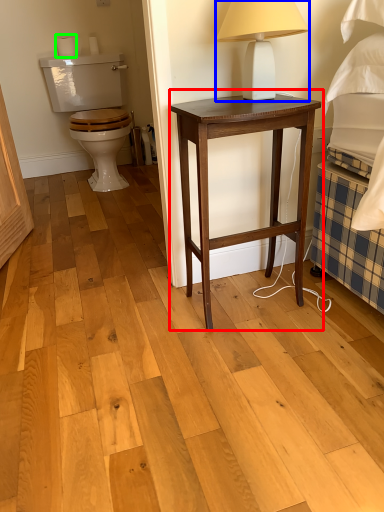
Question: Which is nearer to the nightstand (highlighted by a red box)? table lamp (highlighted by a blue box) or toilet paper (highlighted by a green box).

Choices:
 (A) table lamp
 (B) toilet paper

Answer: (A)